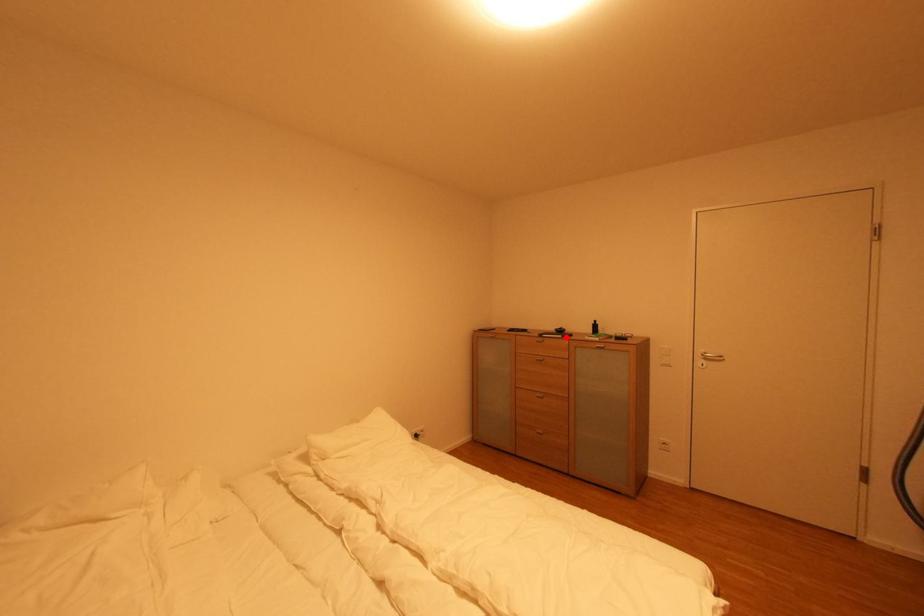
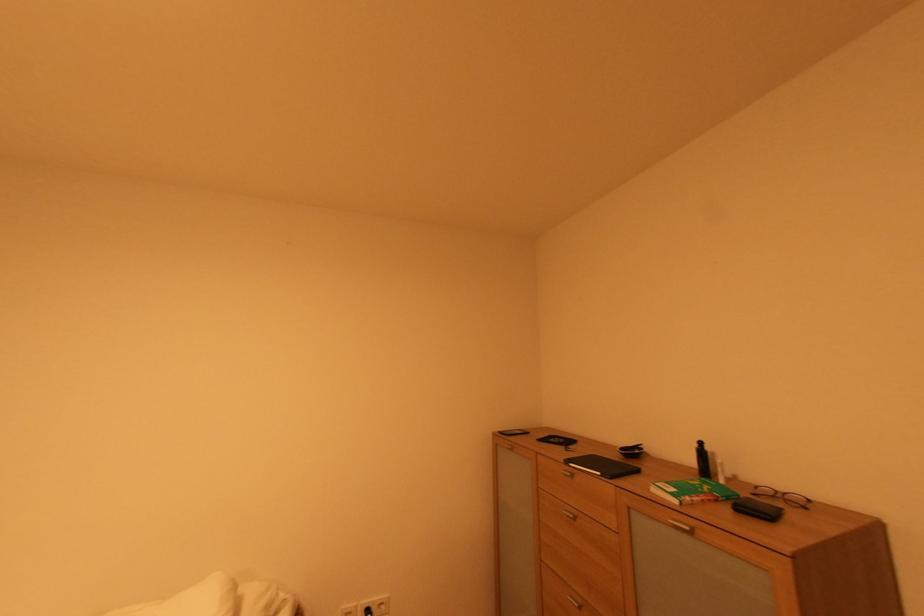
Locate, in the second image, the point that corresponds to the highlighted location in the first image.

(604, 475)